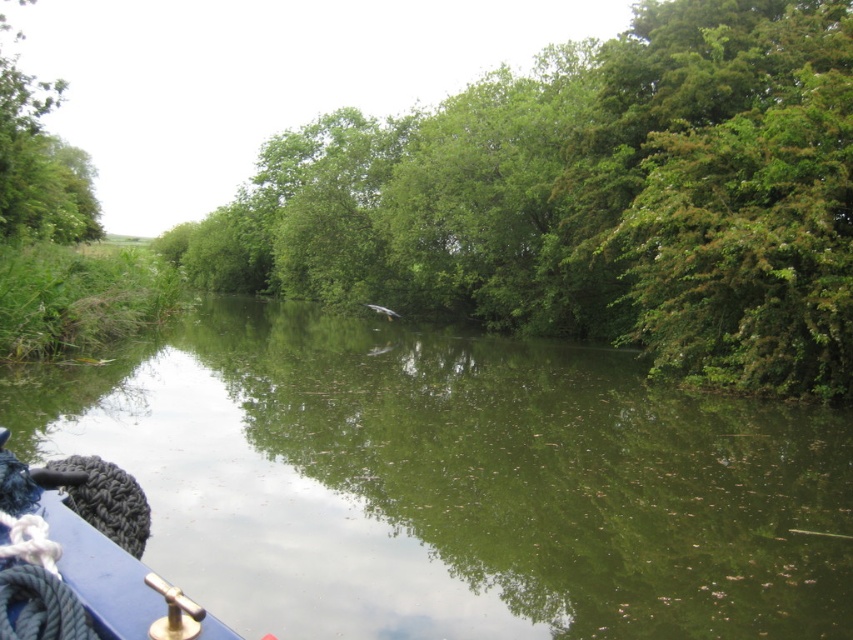
Is blue matte rope at lower left smaller than green leafy tree at upper left?

Correct, blue matte rope at lower left occupies less space than green leafy tree at upper left.

This screenshot has height=640, width=853. Describe the element at coordinates (83, 557) in the screenshot. I see `blue matte rope at lower left` at that location.

I want to click on blue matte rope at lower left, so click(83, 557).

What do you see at coordinates (456, 483) in the screenshot?
I see `green reflective water at center` at bounding box center [456, 483].

Does green reflective water at center have a greater width compared to blue matte rope at lower left?

Yes.

Identify the location of green reflective water at center. This screenshot has height=640, width=853. (456, 483).

You are a GUI agent. You are given a task and a screenshot of the screen. Output one action in this format:
    pyautogui.click(x=<x>, y=<y>)
    Task: Click on the green reflective water at center
    Image resolution: width=853 pixels, height=640 pixels.
    Given the screenshot: What is the action you would take?
    pyautogui.click(x=456, y=483)

Which is behind, point (235, 342) or point (73, 230)?

The point (73, 230) is more distant.

Is green reflective water at center smaller than green leafy tree at upper left?

Indeed, green reflective water at center has a smaller size compared to green leafy tree at upper left.

Where is `green reflective water at center`? This screenshot has height=640, width=853. green reflective water at center is located at coordinates (456, 483).